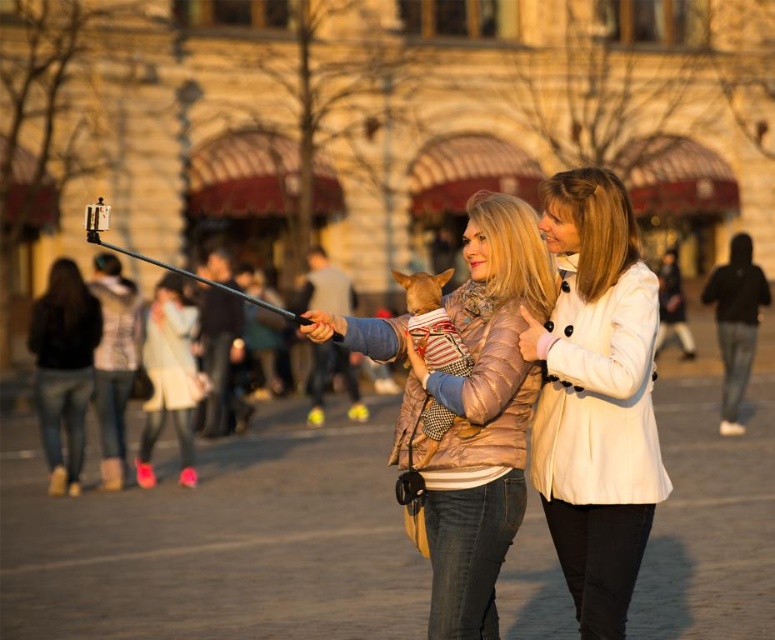
Is white matte coat at center shorter than jeans at left?

No.

Who is positioned more to the right, white matte coat at center or jeans at left?

From the viewer's perspective, white matte coat at center appears more on the right side.

Measure the distance between point [615,188] and camera.

The distance of point [615,188] from camera is 145.03 feet.

This screenshot has height=640, width=775. Find the location of `white matte coat at center`. white matte coat at center is located at coordinates (596, 397).

Is metallic gold jacket at center behind metallic silver pole at center?

No, it is not.

Between metallic gold jacket at center and metallic silver pole at center, which one appears on the right side from the viewer's perspective?

Positioned to the right is metallic gold jacket at center.

Does point (498, 230) lie behind point (95, 236)?

No.

This screenshot has height=640, width=775. In order to click on metallic gold jacket at center in this screenshot , I will do `click(469, 410)`.

Who is shorter, jeans at left or metallic silver pole at center?

Standing shorter between the two is metallic silver pole at center.

Measure the distance between point (35, 342) and camera.

Point (35, 342) and camera are 62.84 meters apart from each other.

Is point (54, 490) in front of point (98, 241)?

No, (54, 490) is behind (98, 241).

Where is `jeans at left`? The image size is (775, 640). jeans at left is located at coordinates (64, 369).